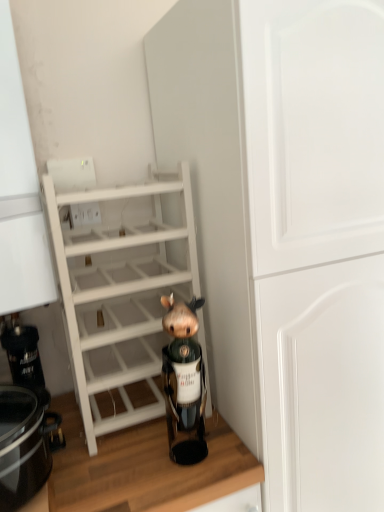
This screenshot has height=512, width=384. I want to click on vacant area that lies between black glossy crock pot at lower left and brown matte figurine at center, so click(124, 466).